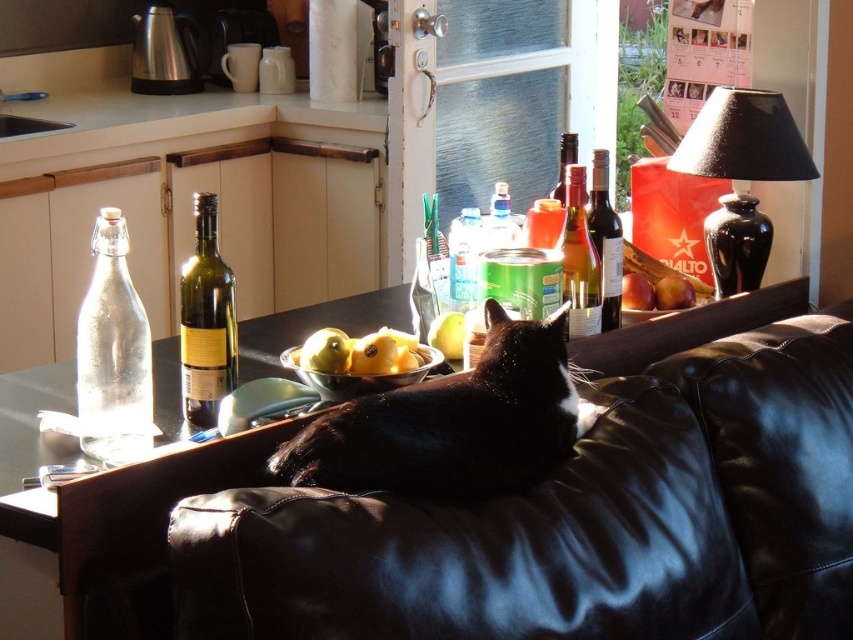
Does black ceramic lamp at upper right have a smaller size compared to yellow matte pear at center?

No.

Is black ceramic lamp at upper right further to the viewer compared to yellow matte pear at center?

Yes.

Based on the photo, who is more distant from viewer, (770,164) or (463,337)?

The point (770,164) is more distant.

This screenshot has height=640, width=853. What are the coordinates of `black ceramic lamp at upper right` in the screenshot? It's located at (741, 177).

Does black fur cat at center have a lesser height compared to smooth red apples at center?

No.

Which is more to the left, black fur cat at center or smooth red apples at center?

Positioned to the left is black fur cat at center.

Who is more forward, [325,483] or [635,307]?

Positioned in front is point [325,483].

Locate an element on the screen. This screenshot has height=640, width=853. black fur cat at center is located at coordinates (451, 424).

Can you confirm if yellow matte pears at center is positioned below yellow matte pear at center?

Indeed, yellow matte pears at center is positioned under yellow matte pear at center.

Between point (328, 364) and point (434, 342), which one is positioned behind?

The point (434, 342) is behind.

You are a GUI agent. You are given a task and a screenshot of the screen. Output one action in this format:
    pyautogui.click(x=<x>, y=<y>)
    Task: Click on the yellow matte pears at center
    This screenshot has height=640, width=853.
    Given the screenshot: What is the action you would take?
    pyautogui.click(x=358, y=353)